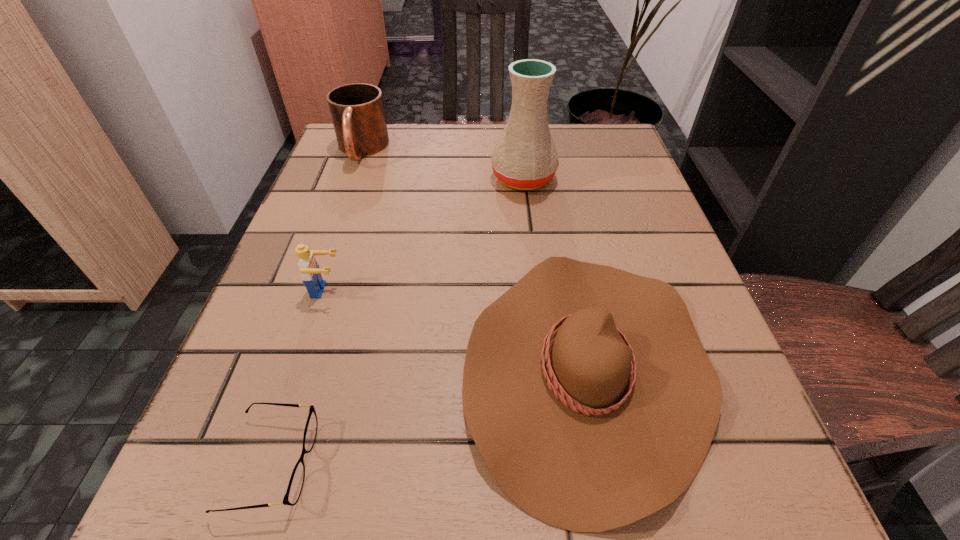
Locate an element on the screen. vacant space that satisfies the following two spatial constraints: 1. on the front side of the tallest object; 2. on the front-facing side of the shortest object is located at coordinates (558, 463).

I want to click on vacant space that satisfies the following two spatial constraints: 1. on the back side of the fourth tallest object; 2. on the face of the Lego, so click(x=572, y=290).

The image size is (960, 540). Identify the location of vacant region that satisfies the following two spatial constraints: 1. on the face of the third shortest object; 2. on the left side of the fourth tallest object. (301, 368).